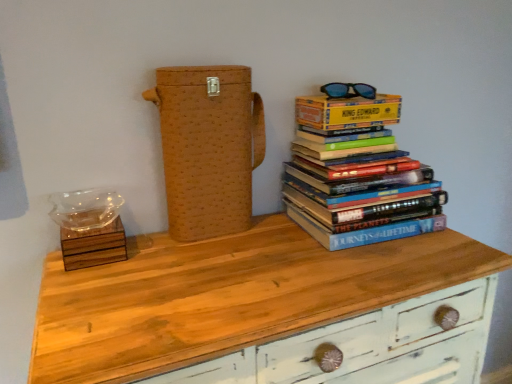
In order to click on spots to the right of brown woven box at center in this screenshot , I will do `click(278, 237)`.